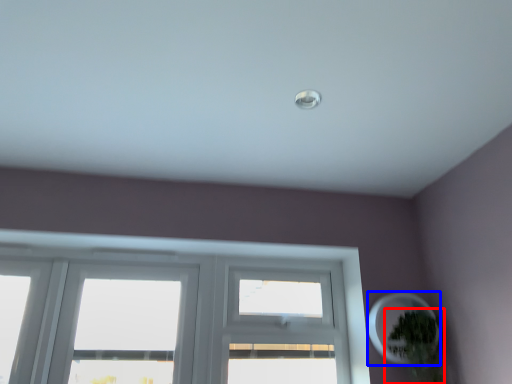
Question: Among these objects, which one is nearest to the camera, houseplant (highlighted by a red box) or oval (highlighted by a blue box)?

Choices:
 (A) houseplant
 (B) oval

Answer: (A)